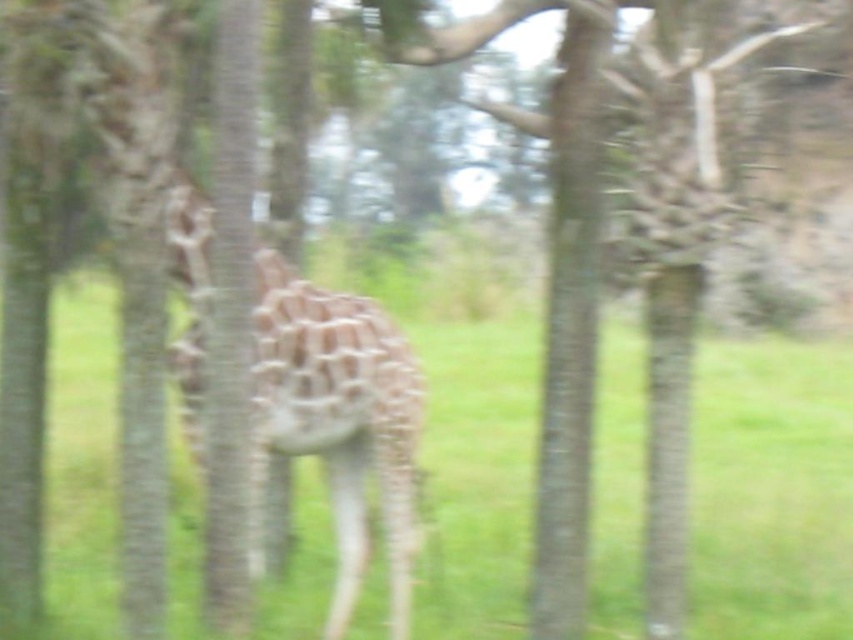
Which is behind, point (572, 532) or point (219, 3)?

Point (572, 532)

Can you confirm if smooth bark tree trunk at center is wider than brown rough tree trunk at center?

Indeed, smooth bark tree trunk at center has a greater width compared to brown rough tree trunk at center.

Where is `smooth bark tree trunk at center`? smooth bark tree trunk at center is located at coordinates (569, 324).